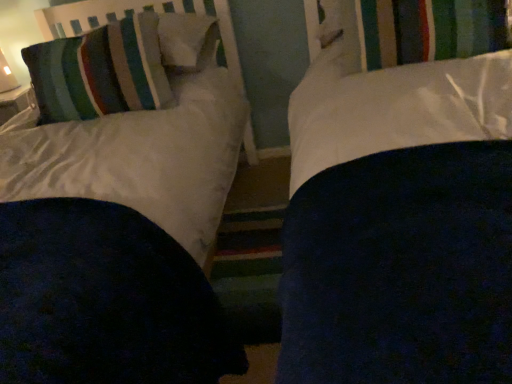
Question: Can you confirm if striped fabric headboard at upper left is smaller than striped fabric pillow at upper left?

Choices:
 (A) yes
 (B) no

Answer: (A)

Question: From the image's perspective, is striped fabric headboard at upper left located beneath striped fabric pillow at upper left?

Choices:
 (A) yes
 (B) no

Answer: (B)

Question: Is striped fabric headboard at upper left turned away from striped fabric pillow at upper left?

Choices:
 (A) no
 (B) yes

Answer: (A)

Question: Is striped fabric headboard at upper left shorter than striped fabric pillow at upper left?

Choices:
 (A) no
 (B) yes

Answer: (B)

Question: Is striped fabric headboard at upper left positioned beyond the bounds of striped fabric pillow at upper left?

Choices:
 (A) no
 (B) yes

Answer: (B)

Question: From a real-world perspective, is striped fabric headboard at upper left on top of striped fabric pillow at upper left?

Choices:
 (A) yes
 (B) no

Answer: (A)

Question: Is striped fabric pillow at upper left to the right of striped fabric curtain at upper center from the viewer's perspective?

Choices:
 (A) no
 (B) yes

Answer: (A)

Question: From a real-world perspective, is striped fabric pillow at upper left on striped fabric curtain at upper center?

Choices:
 (A) no
 (B) yes

Answer: (B)

Question: Does striped fabric pillow at upper left have a lesser width compared to striped fabric curtain at upper center?

Choices:
 (A) yes
 (B) no

Answer: (A)

Question: Does striped fabric pillow at upper left appear on the left side of striped fabric curtain at upper center?

Choices:
 (A) yes
 (B) no

Answer: (A)

Question: From a real-world perspective, is striped fabric pillow at upper left below striped fabric curtain at upper center?

Choices:
 (A) no
 (B) yes

Answer: (A)

Question: Is striped fabric pillow at upper left facing away from striped fabric curtain at upper center?

Choices:
 (A) no
 (B) yes

Answer: (A)

Question: From the image's perspective, is striped fabric curtain at upper center over striped fabric pillow at upper left?

Choices:
 (A) yes
 (B) no

Answer: (A)